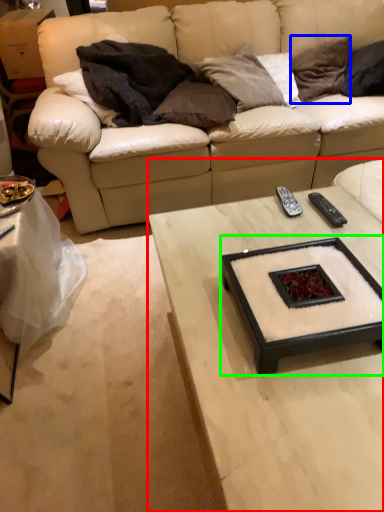
Question: Which is nearer to the coffee table (highlighted by a red box)? pillow (highlighted by a blue box) or round table (highlighted by a green box).

Choices:
 (A) pillow
 (B) round table

Answer: (B)